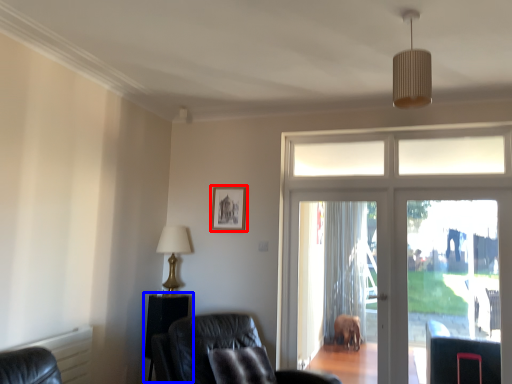
Question: Which object is further to the camera taking this photo, picture frame (highlighted by a red box) or side table (highlighted by a blue box)?

Choices:
 (A) picture frame
 (B) side table

Answer: (A)